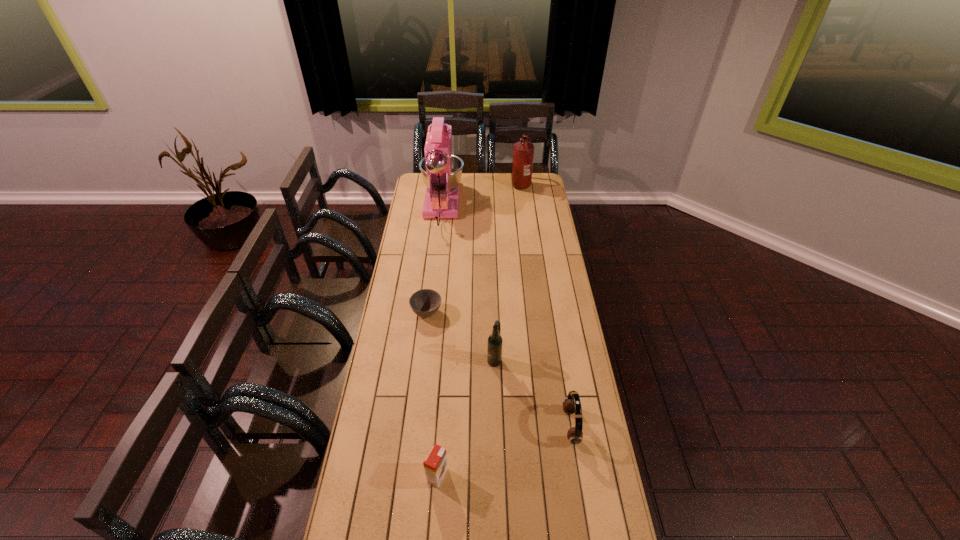
I want to click on mixer located in the far edge section of the desktop, so click(441, 171).

Find the location of a particular element. fire extinguisher that is positioned at the far edge is located at coordinates (523, 152).

Where is `mixer at the left edge`? The height and width of the screenshot is (540, 960). mixer at the left edge is located at coordinates (441, 171).

The height and width of the screenshot is (540, 960). In order to click on bowl that is at the left edge in this screenshot , I will do `click(425, 303)`.

Find the location of a particular element. fire extinguisher at the right edge is located at coordinates (523, 152).

Image resolution: width=960 pixels, height=540 pixels. What are the coordinates of `headset located at the right edge` in the screenshot? It's located at (571, 404).

This screenshot has height=540, width=960. In order to click on object present at the far left corner in this screenshot , I will do `click(441, 171)`.

At what (x,y) coordinates should I click in order to perform the action: click on object at the far right corner. Please return your answer as a coordinate pair (x, y). The width and height of the screenshot is (960, 540). Looking at the image, I should click on (523, 152).

The height and width of the screenshot is (540, 960). I want to click on free space at the far edge of the desktop, so click(482, 184).

The image size is (960, 540). I want to click on free space at the left edge, so click(x=419, y=226).